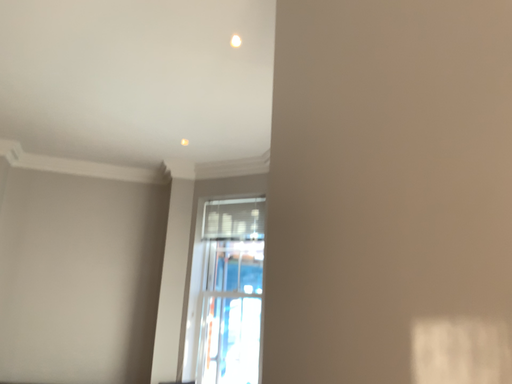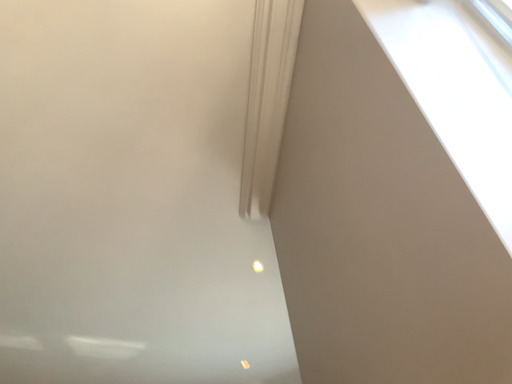
Question: Which way did the camera rotate in the video?

Choices:
 (A) rotated downward
 (B) rotated upward

Answer: (B)